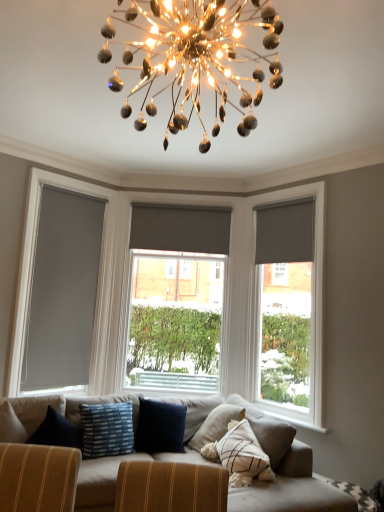
Question: Can you confirm if shiny metallic chandelier at upper center is taller than matte gray roller blind at center, which is the 1th window from left to right?

Choices:
 (A) yes
 (B) no

Answer: (B)

Question: Is shiny metallic chandelier at upper center oriented away from matte gray roller blind at center, placed as the 2th window when sorted from right to left?

Choices:
 (A) no
 (B) yes

Answer: (A)

Question: From the image's perspective, does shiny metallic chandelier at upper center appear lower than matte gray roller blind at center, which is the 1th window from left to right?

Choices:
 (A) no
 (B) yes

Answer: (A)

Question: Is shiny metallic chandelier at upper center bigger than matte gray roller blind at center, placed as the 2th window when sorted from right to left?

Choices:
 (A) no
 (B) yes

Answer: (A)

Question: Is shiny metallic chandelier at upper center next to matte gray roller blind at center, which is the 1th window from left to right?

Choices:
 (A) no
 (B) yes

Answer: (A)

Question: Is shiny metallic chandelier at upper center inside the boundaries of matte gray roller blind at right, positioned as the first curtain in right-to-left order, or outside?

Choices:
 (A) outside
 (B) inside

Answer: (A)

Question: Considering the positions of point (135, 68) and point (281, 206), is point (135, 68) closer or farther from the camera than point (281, 206)?

Choices:
 (A) farther
 (B) closer

Answer: (B)

Question: From the image's perspective, is shiny metallic chandelier at upper center positioned above or below matte gray roller blind at right, arranged as the 2th curtain when viewed from the left?

Choices:
 (A) below
 (B) above

Answer: (B)

Question: Looking at the image, does shiny metallic chandelier at upper center seem bigger or smaller compared to matte gray roller blind at right, arranged as the 2th curtain when viewed from the left?

Choices:
 (A) big
 (B) small

Answer: (A)

Question: From a real-world perspective, relative to matte gray roller blind at center, placed as the 2th window when sorted from right to left, is blue striped fabric pillow at center vertically above or below?

Choices:
 (A) above
 (B) below

Answer: (B)

Question: Based on their positions, is blue striped fabric pillow at center located to the left or right of matte gray roller blind at center, which is the 1th window from left to right?

Choices:
 (A) right
 (B) left

Answer: (B)

Question: Is blue striped fabric pillow at center wider or thinner than matte gray roller blind at center, placed as the 2th window when sorted from right to left?

Choices:
 (A) wide
 (B) thin

Answer: (A)

Question: Looking at the image, does blue striped fabric pillow at center seem bigger or smaller compared to matte gray roller blind at center, which is the 1th window from left to right?

Choices:
 (A) big
 (B) small

Answer: (B)

Question: In terms of width, does textured beige couch at center look wider or thinner when compared to blue striped fabric pillow at center?

Choices:
 (A) thin
 (B) wide

Answer: (B)

Question: From their relative heights in the image, would you say textured beige couch at center is taller or shorter than blue striped fabric pillow at center?

Choices:
 (A) short
 (B) tall

Answer: (B)